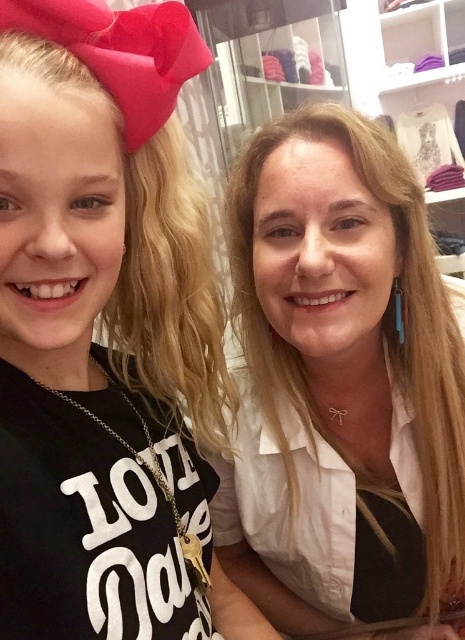
Question: From the image, what is the correct spatial relationship of black matte shirt at left in relation to white satin blouse at center?

Choices:
 (A) above
 (B) below

Answer: (A)

Question: Is black matte shirt at left further to the viewer compared to white satin blouse at center?

Choices:
 (A) yes
 (B) no

Answer: (B)

Question: Can you confirm if black matte shirt at left is bigger than white satin blouse at center?

Choices:
 (A) yes
 (B) no

Answer: (B)